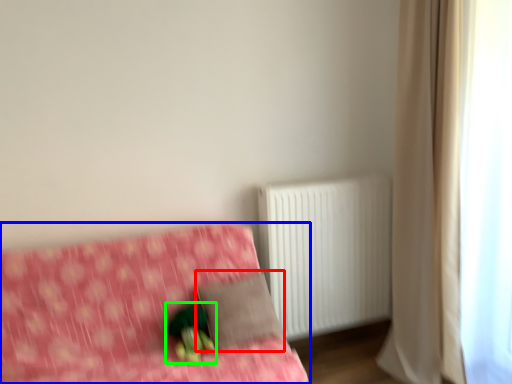
Question: Considering the real-world distances, which object is closest to pillow (highlighted by a red box)? furniture (highlighted by a blue box) or figurine (highlighted by a green box).

Choices:
 (A) furniture
 (B) figurine

Answer: (B)